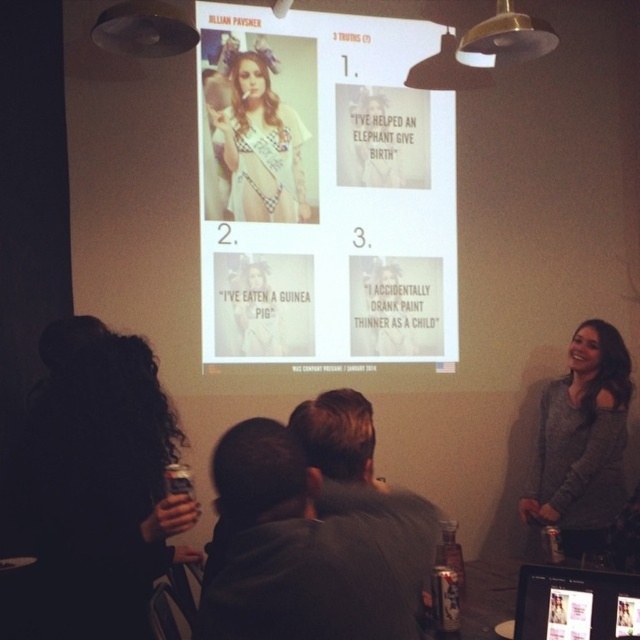
Is gray sweater at center in front of matte plastic screen at lower right?

That is False.

Does gray sweater at center lie behind matte plastic screen at lower right?

Yes, it is behind matte plastic screen at lower right.

Which is in front, point (582, 396) or point (604, 588)?

Point (604, 588)

At what (x,y) coordinates should I click in order to perform the action: click on gray sweater at center. Please return your answer as a coordinate pair (x, y). Looking at the image, I should click on (582, 442).

How far apart are dark curly hair at lower left and gray sweater at center?

dark curly hair at lower left is 7.76 feet from gray sweater at center.

Is point (100, 403) less distant than point (580, 509)?

Yes, it is.

This screenshot has height=640, width=640. Find the location of `dark curly hair at lower left`. dark curly hair at lower left is located at coordinates (99, 483).

How much distance is there between white paper at center and dark gray hoodie at center?

white paper at center and dark gray hoodie at center are 8.98 feet apart.

Is white paper at center thinner than dark gray hoodie at center?

In fact, white paper at center might be wider than dark gray hoodie at center.

Between point (435, 163) and point (406, 634), which one is positioned behind?

The point (435, 163) is behind.

Locate an element on the screen. white paper at center is located at coordinates (323, 189).